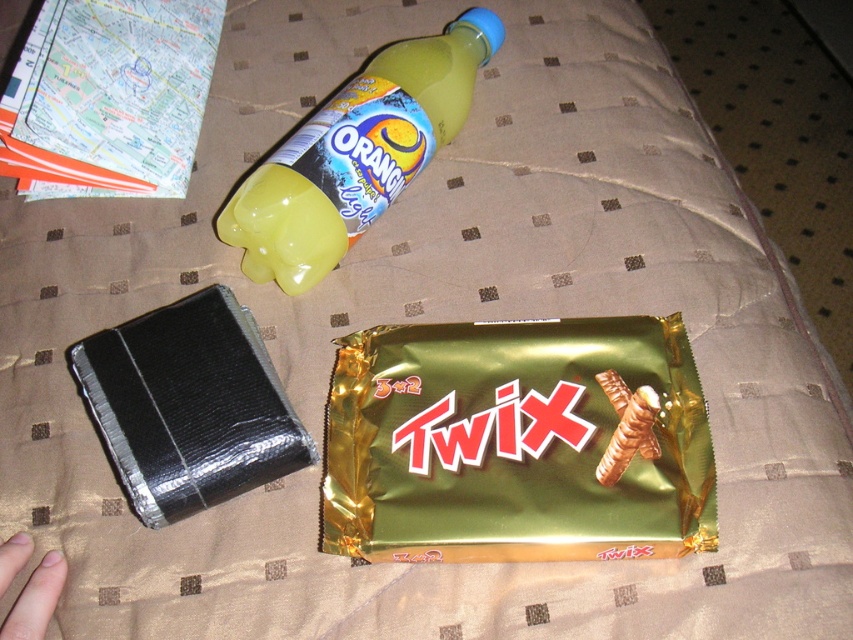
Is point (206, 353) less distant than point (349, 106)?

Yes, point (206, 353) is closer to viewer.

Does black foil-wrapped chocolate bar at lower left have a larger size compared to yellow translucent plastic bottle at upper center?

Actually, black foil-wrapped chocolate bar at lower left might be smaller than yellow translucent plastic bottle at upper center.

Locate an element on the screen. black foil-wrapped chocolate bar at lower left is located at coordinates tap(189, 404).

Can you confirm if green shiny chocolate bar at center is positioned to the right of black foil-wrapped chocolate bar at lower left?

Indeed, green shiny chocolate bar at center is positioned on the right side of black foil-wrapped chocolate bar at lower left.

Describe the element at coordinates (517, 442) in the screenshot. I see `green shiny chocolate bar at center` at that location.

Who is more forward, (349, 435) or (149, 387)?

Point (149, 387)

Locate an element on the screen. green shiny chocolate bar at center is located at coordinates point(517,442).

Does green shiny chocolate bar at center have a lesser height compared to yellow translucent plastic bottle at upper center?

Yes, green shiny chocolate bar at center is shorter than yellow translucent plastic bottle at upper center.

Who is more forward, (x=602, y=476) or (x=465, y=70)?

Point (x=602, y=476)

In order to click on green shiny chocolate bar at center in this screenshot , I will do `click(517, 442)`.